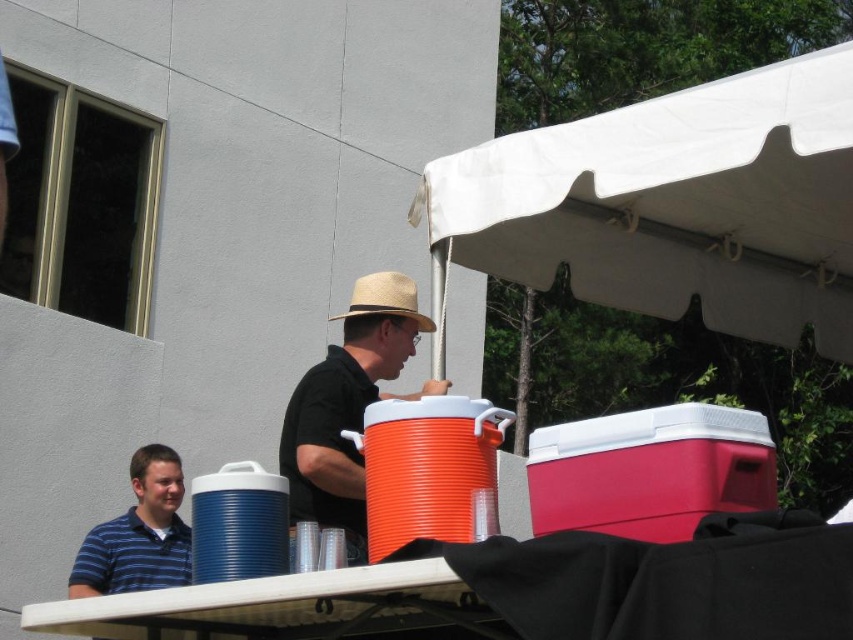
Question: Where is white plastic table at lower center located in relation to strawhat at center in the image?

Choices:
 (A) right
 (B) left

Answer: (A)

Question: Based on their relative distances, which object is farther from the strawhat at center?

Choices:
 (A) matte straw hat at center
 (B) blue striped shirt at lower left
 (C) white plastic table at lower center

Answer: (C)

Question: Is white plastic table at lower center below strawhat at center?

Choices:
 (A) yes
 (B) no

Answer: (A)

Question: Which point appears farthest from the camera in this image?

Choices:
 (A) 178,541
 (B) 358,296
 (C) 347,452
 (D) 326,612

Answer: (A)

Question: Which of these objects is positioned closest to the strawhat at center?

Choices:
 (A) blue striped shirt at lower left
 (B) white plastic table at lower center

Answer: (A)

Question: Is white plastic table at lower center smaller than strawhat at center?

Choices:
 (A) yes
 (B) no

Answer: (A)